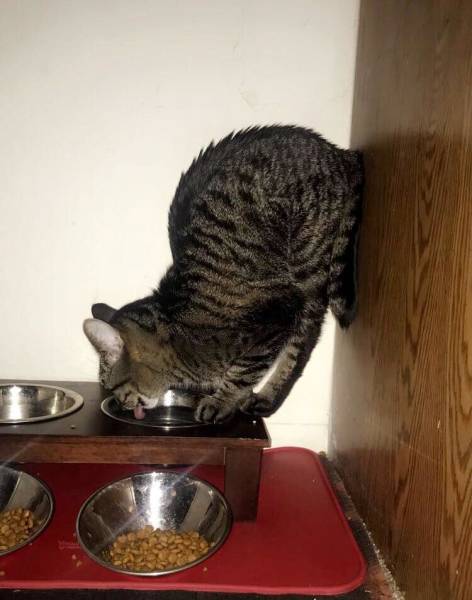
Locate an element on the screen. Image resolution: width=472 pixels, height=600 pixels. food bowl is located at coordinates (161, 536), (15, 511).